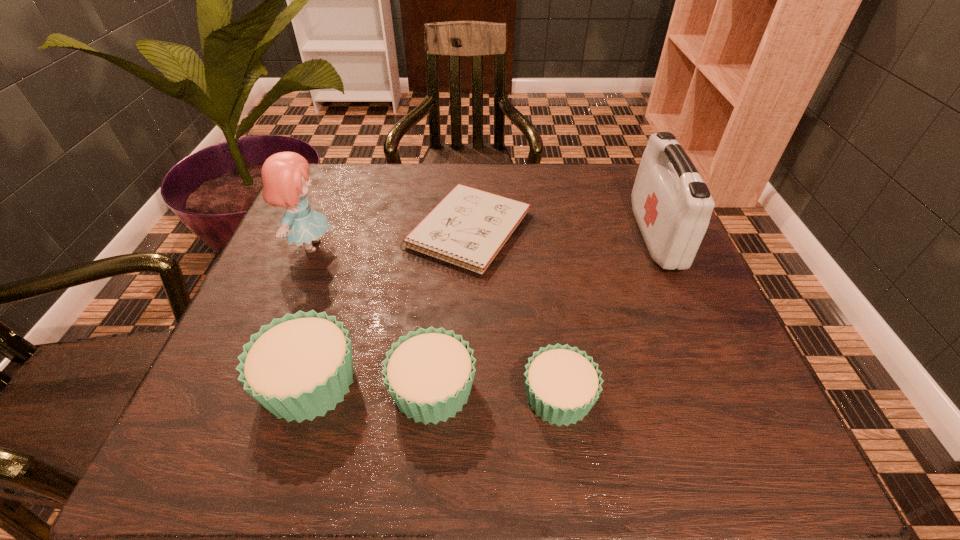
Locate an element on the screen. object that is positioned at the right edge is located at coordinates (672, 205).

The image size is (960, 540). I want to click on object located in the near left corner section of the desktop, so click(x=299, y=366).

Where is `object located at the far right corner`? This screenshot has width=960, height=540. object located at the far right corner is located at coordinates (672, 205).

Locate an element on the screen. This screenshot has height=540, width=960. free spot at the far edge of the desktop is located at coordinates (483, 171).

The image size is (960, 540). In the image, there is a desktop. Identify the location of vacant space at the near edge. (478, 370).

In the image, there is a desktop. At what (x,y) coordinates should I click in order to perform the action: click on vacant space at the left edge. Please return your answer as a coordinate pair (x, y). Image resolution: width=960 pixels, height=540 pixels. Looking at the image, I should click on (244, 308).

This screenshot has width=960, height=540. In order to click on vacant space at the right edge in this screenshot , I will do `click(684, 361)`.

Locate an element on the screen. vacant area at the far left corner is located at coordinates (348, 177).

Where is `free region at the near left corner of the desktop`? Image resolution: width=960 pixels, height=540 pixels. free region at the near left corner of the desktop is located at coordinates click(x=195, y=407).

Where is `free region at the far right corner of the desktop`? free region at the far right corner of the desktop is located at coordinates (637, 166).